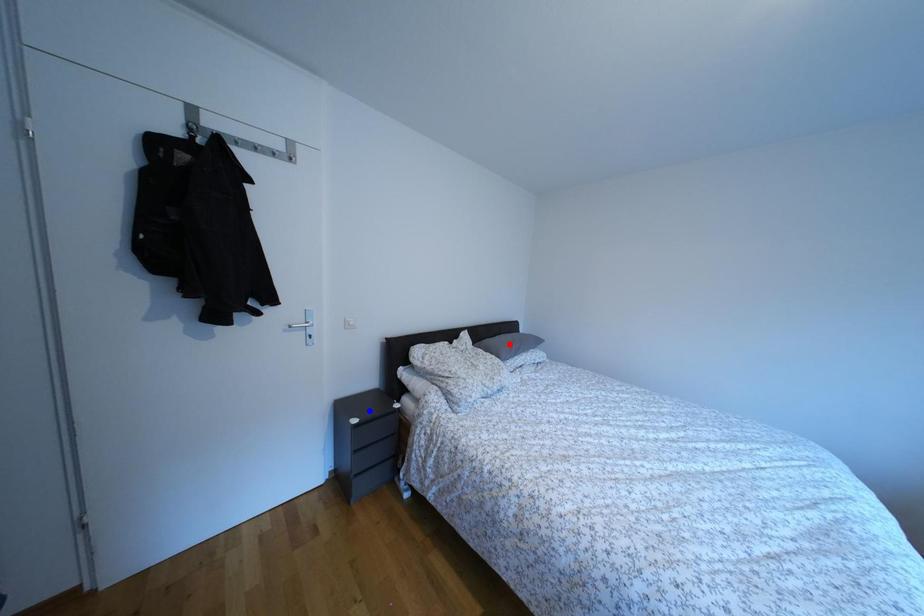
Question: Which of the two points in the image is closer to the camera?

Choices:
 (A) Blue point is closer.
 (B) Red point is closer.

Answer: (A)